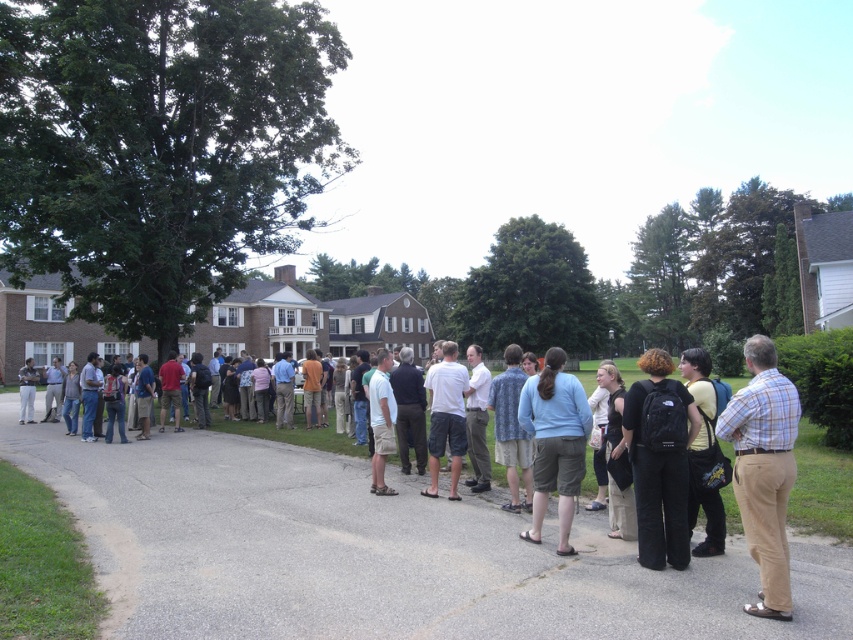
Can you confirm if white cotton shirt at center is positioned to the right of matte black jacket at center?

Yes, white cotton shirt at center is to the right of matte black jacket at center.

Does white cotton shirt at center appear over matte black jacket at center?

Correct, white cotton shirt at center is located above matte black jacket at center.

Which is behind, point (456, 464) or point (25, 371)?

The point (25, 371) is more distant.

Locate an element on the screen. The height and width of the screenshot is (640, 853). white cotton shirt at center is located at coordinates (445, 417).

Is gray asphalt driveway at center shorter than yellow cotton shirt at center?

Yes.

Between point (332, 580) and point (714, 506), which one is positioned in front?

Point (332, 580) is more forward.

At what (x,y) coordinates should I click in order to perform the action: click on gray asphalt driveway at center. Please return your answer as a coordinate pair (x, y). The width and height of the screenshot is (853, 640). Looking at the image, I should click on coord(375,552).

Can you confirm if plaid cotton shirt at center-right is positioned to the left of yellow cotton shirt at center?

Correct, you'll find plaid cotton shirt at center-right to the left of yellow cotton shirt at center.

Can you confirm if plaid cotton shirt at center-right is smaller than yellow cotton shirt at center?

Indeed, plaid cotton shirt at center-right has a smaller size compared to yellow cotton shirt at center.

Who is more forward, (785, 556) or (698, 400)?

Positioned in front is point (785, 556).

Where is `plaid cotton shirt at center-right`? This screenshot has height=640, width=853. plaid cotton shirt at center-right is located at coordinates (763, 468).